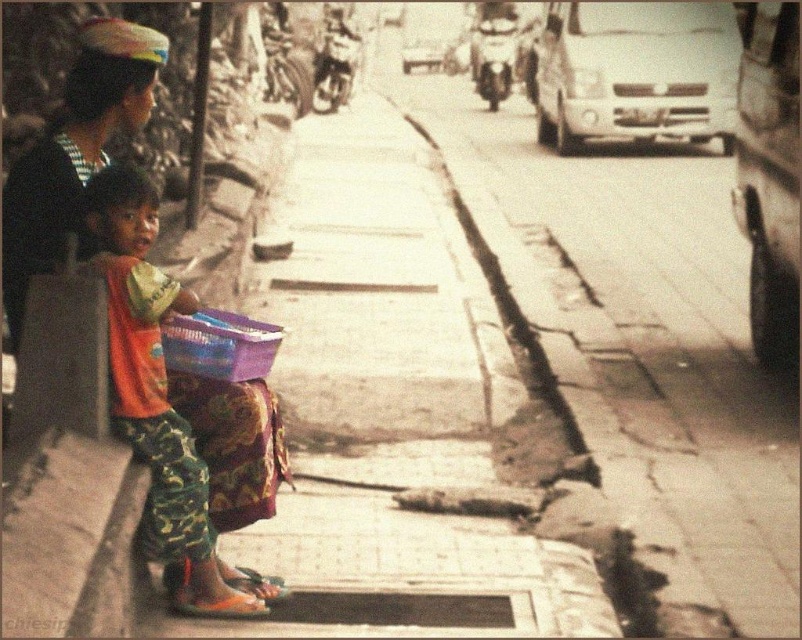
Is cracked concrete sidewalk at center taller than purple woven basket at lower center?

Yes.

Can you confirm if cracked concrete sidewalk at center is bigger than purple woven basket at lower center?

Yes, cracked concrete sidewalk at center is bigger than purple woven basket at lower center.

This screenshot has width=802, height=640. What do you see at coordinates (638, 356) in the screenshot?
I see `cracked concrete sidewalk at center` at bounding box center [638, 356].

Locate an element on the screen. This screenshot has width=802, height=640. cracked concrete sidewalk at center is located at coordinates (638, 356).

Who is taller, cracked concrete sidewalk at center or camouflage pants at left?

cracked concrete sidewalk at center is taller.

Who is positioned more to the right, cracked concrete sidewalk at center or camouflage pants at left?

Positioned to the right is cracked concrete sidewalk at center.

What do you see at coordinates (638, 356) in the screenshot? The height and width of the screenshot is (640, 802). I see `cracked concrete sidewalk at center` at bounding box center [638, 356].

Find the location of a particular element. cracked concrete sidewalk at center is located at coordinates (638, 356).

Is the position of smooth concrete pavement at center more distant than that of camouflage pants at left?

Yes, it is behind camouflage pants at left.

Is point (395, 138) farther from viewer compared to point (173, 460)?

Yes, it is behind point (173, 460).

At what (x,y) coordinates should I click in order to perform the action: click on smooth concrete pavement at center. Please return your answer as a coordinate pair (x, y). Looking at the image, I should click on (395, 412).